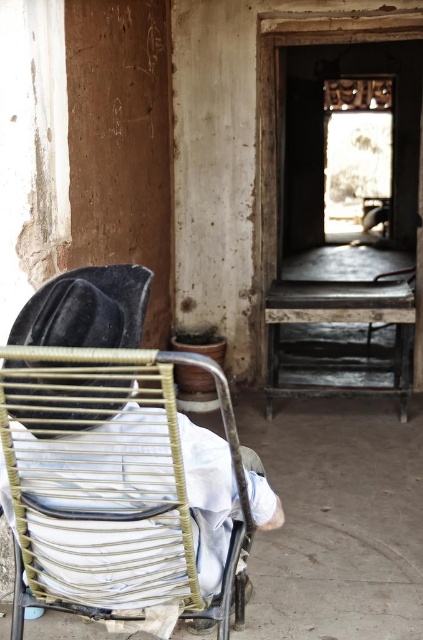
Question: Is the position of woven wood rocking chair at center more distant than that of velvet black hat at upper left?

Choices:
 (A) no
 (B) yes

Answer: (A)

Question: Can you confirm if woven wood rocking chair at center is positioned below velvet black hat at upper left?

Choices:
 (A) no
 (B) yes

Answer: (B)

Question: Is woven wood rocking chair at center to the right of velvet black hat at upper left from the viewer's perspective?

Choices:
 (A) yes
 (B) no

Answer: (A)

Question: Among these objects, which one is farthest from the camera?

Choices:
 (A) velvet black hat at upper left
 (B) woven wood rocking chair at center

Answer: (A)

Question: Which of the following is the farthest from the observer?

Choices:
 (A) (104, 273)
 (B) (52, 326)

Answer: (A)